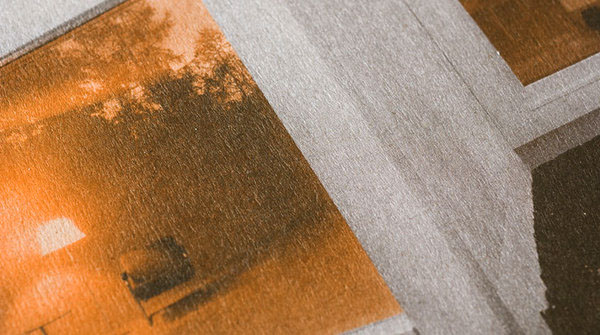
Identify the location of chair. The width and height of the screenshot is (600, 335). (164, 277).